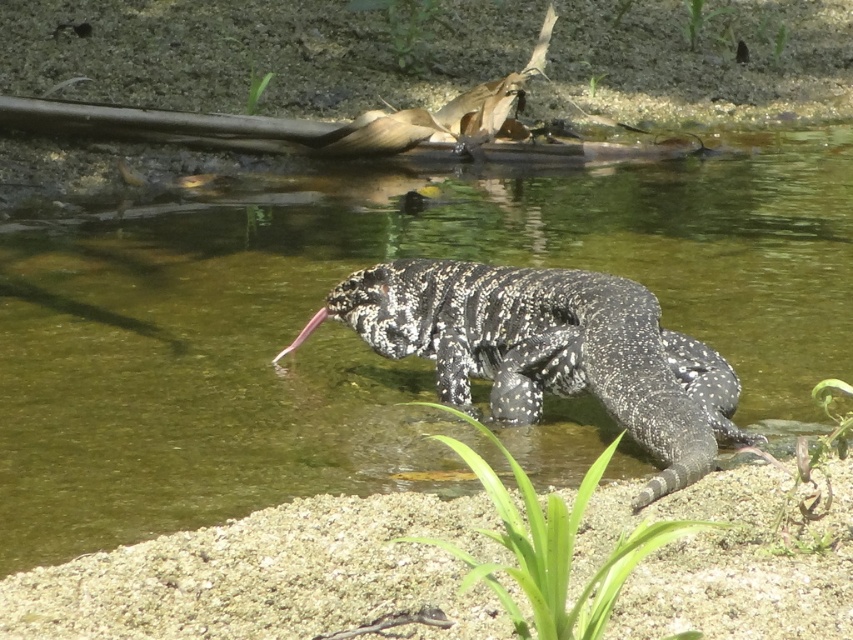
Question: Is clear water at center positioned before speckled scaly lizard at center?

Choices:
 (A) yes
 (B) no

Answer: (B)

Question: Which point is farther from the camera taking this photo?

Choices:
 (A) (90, 232)
 (B) (524, 268)

Answer: (A)

Question: Does clear water at center have a smaller size compared to speckled scaly lizard at center?

Choices:
 (A) yes
 (B) no

Answer: (B)

Question: In this image, where is clear water at center located relative to speckled scaly lizard at center?

Choices:
 (A) below
 (B) above

Answer: (B)